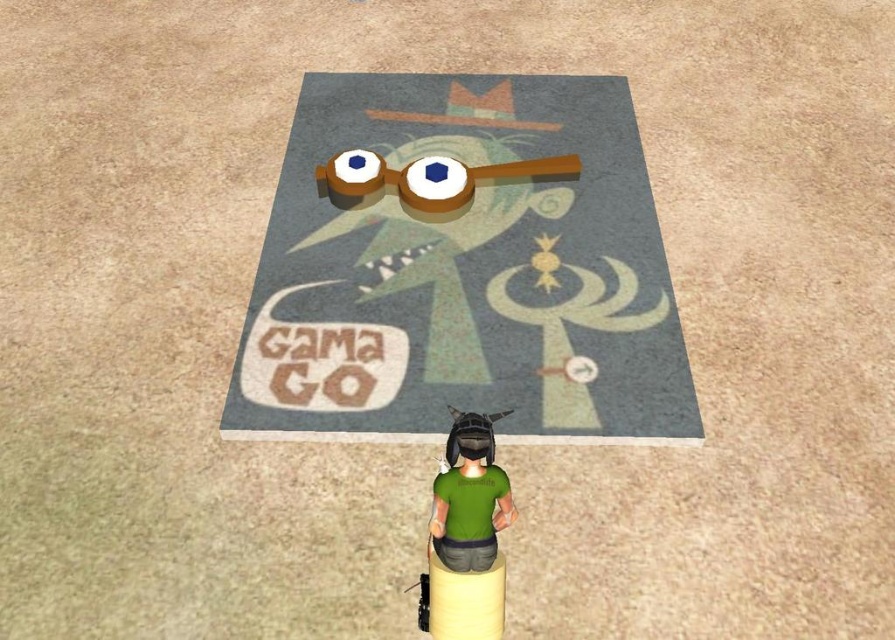
Question: Is the position of matte green carpet at center less distant than that of green matte shirt at lower center?

Choices:
 (A) no
 (B) yes

Answer: (A)

Question: Which point is closer to the camera?

Choices:
 (A) matte green carpet at center
 (B) green matte shirt at lower center

Answer: (B)

Question: Is matte green carpet at center positioned in front of green matte shirt at lower center?

Choices:
 (A) yes
 (B) no

Answer: (B)

Question: Among these objects, which one is farthest from the camera?

Choices:
 (A) matte green carpet at center
 (B) green matte shirt at lower center

Answer: (A)

Question: Can you confirm if matte green carpet at center is positioned to the left of green matte shirt at lower center?

Choices:
 (A) no
 (B) yes

Answer: (A)